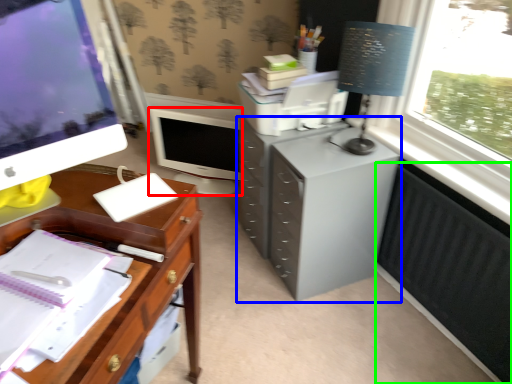
Question: Based on their relative distances, which object is nearer to computer monitor (highlighted by a red box)? Choose from filing cabinet (highlighted by a blue box) and radiator (highlighted by a green box).

Choices:
 (A) filing cabinet
 (B) radiator

Answer: (A)